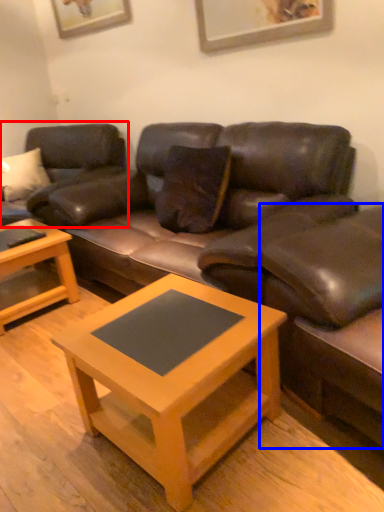
Question: Which of the following is the closest to the observer, studio couch (highlighted by a red box) or swivel chair (highlighted by a blue box)?

Choices:
 (A) studio couch
 (B) swivel chair

Answer: (B)